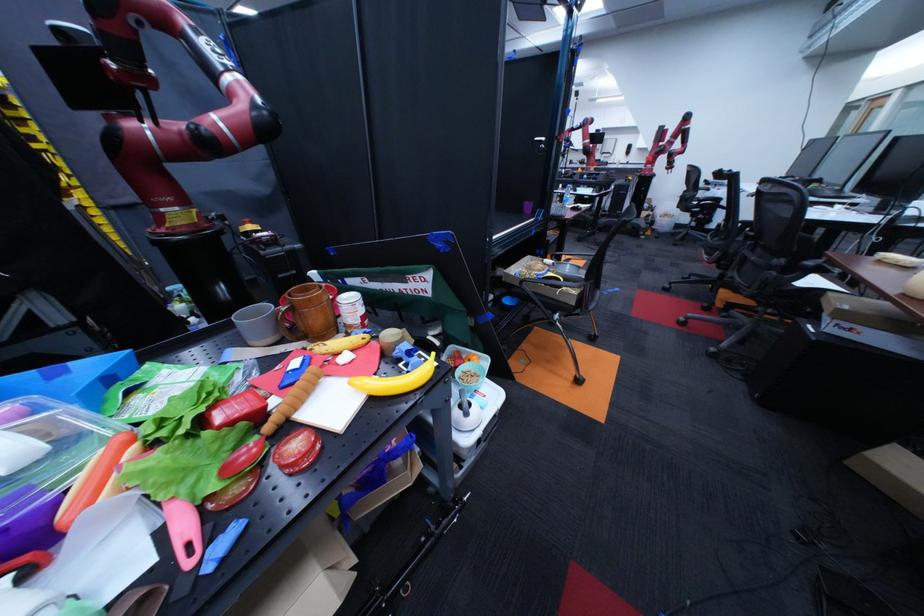
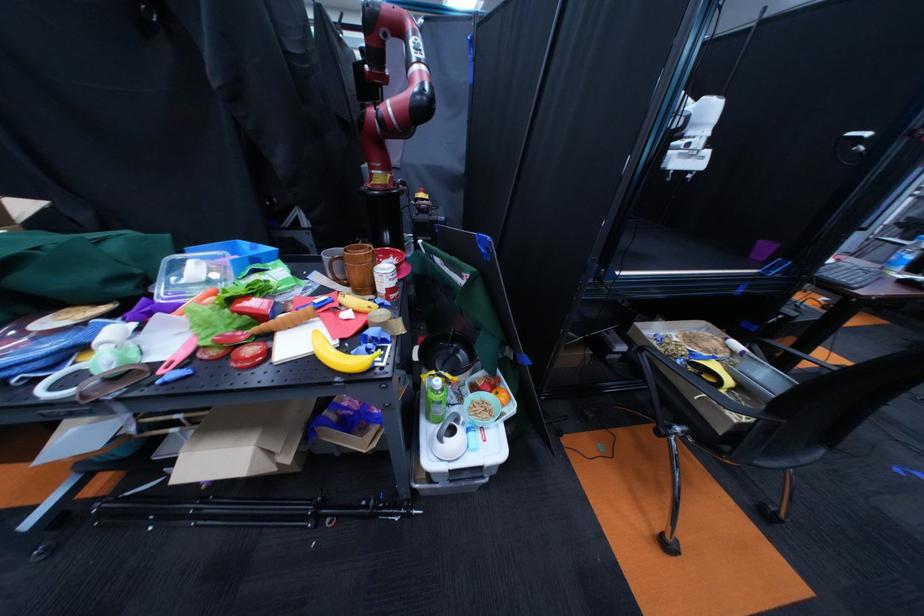
The point at (351, 334) is marked in the first image. Where is the corresponding point in the second image?

(386, 294)